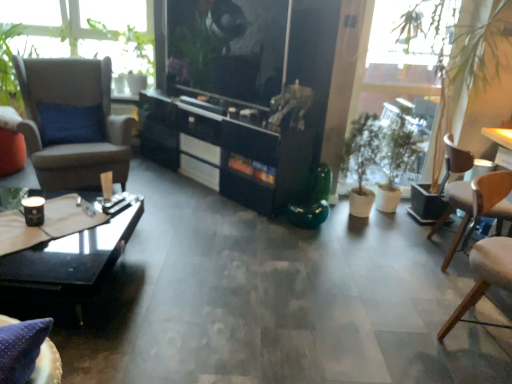
Locate an element on the screen. Image resolution: width=512 pixels, height=384 pixels. free spot above black glass coffee table at lower left (from a real-world perspective) is located at coordinates (59, 225).